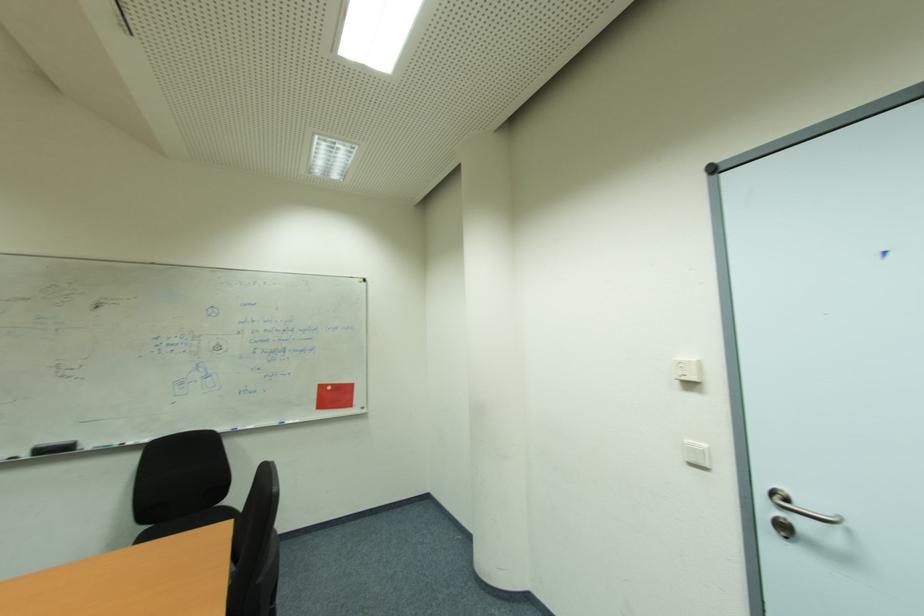
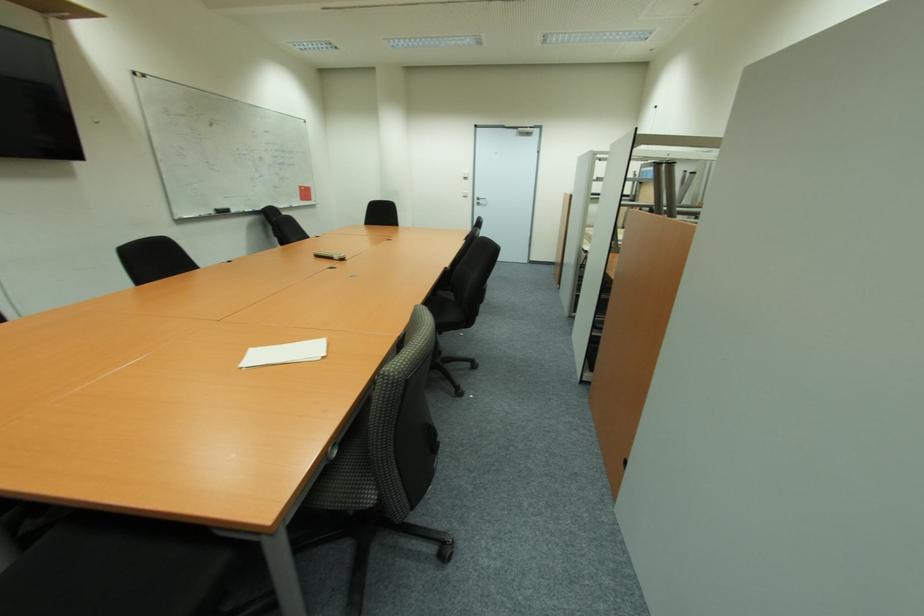
In the second image, find the point that corresponds to pixel 30 456 in the first image.

(215, 214)